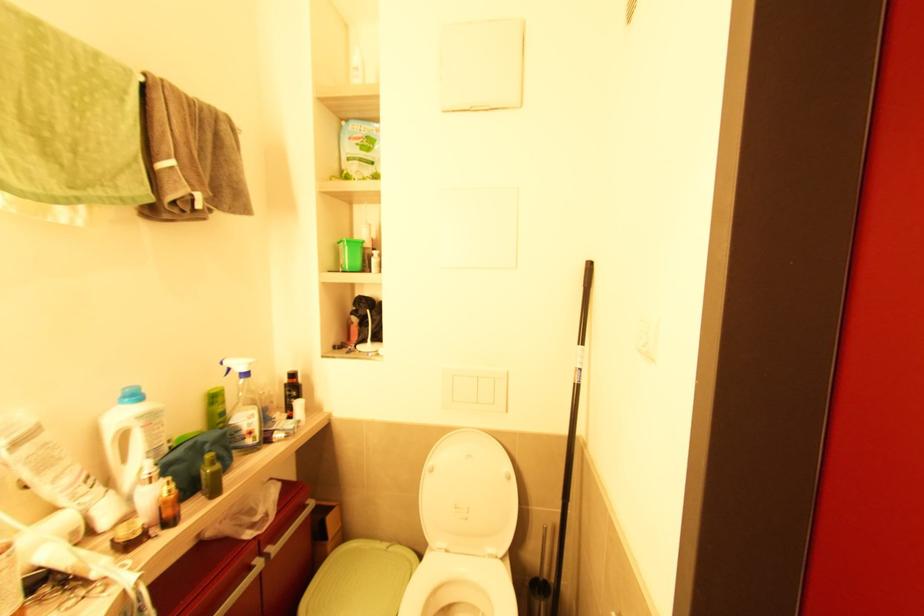
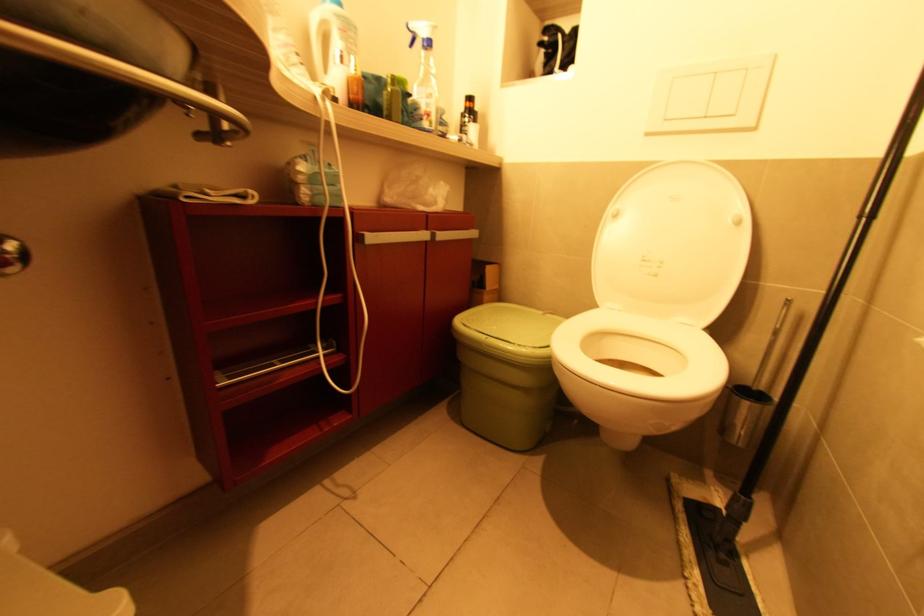
Find the pixel in the second image that matches (x=242, y=374) in the first image.

(427, 42)